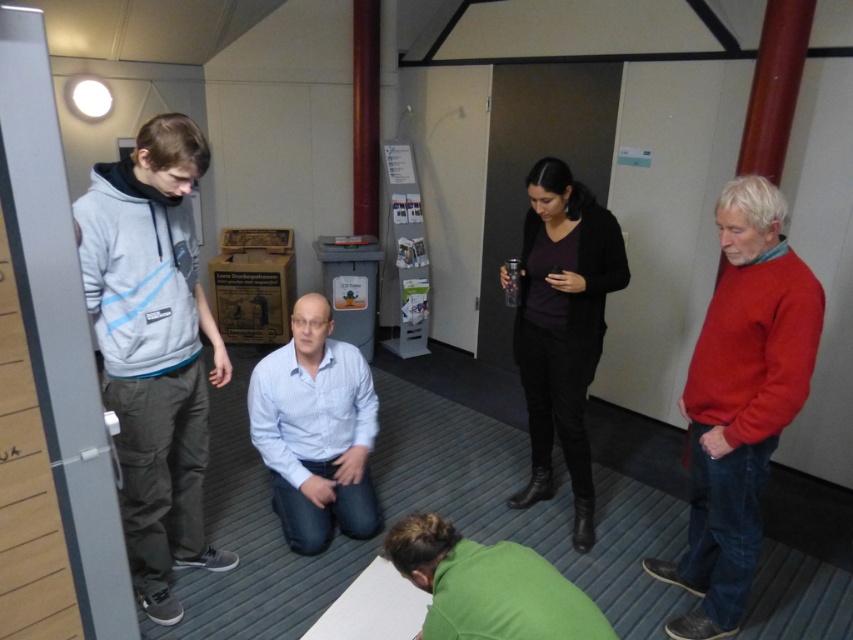
You are standing in the room and want to hand a tool to both the light gray hoodie at left and the matte black sweater at center. Which person should you approach first to ensure you can reach them without moving further into the room?

You should approach the light gray hoodie at left first because they are closer to you than the matte black sweater at center, so you can reach them without moving further into the room.

You are organizing a clothing donation drive and need to determine which sweater takes up more space when placed side by side. Based on the image, which sweater between the red sweater at right and the matte black sweater at center requires more horizontal space?

The matte black sweater at center requires more horizontal space because it has a greater width than the red sweater at right.